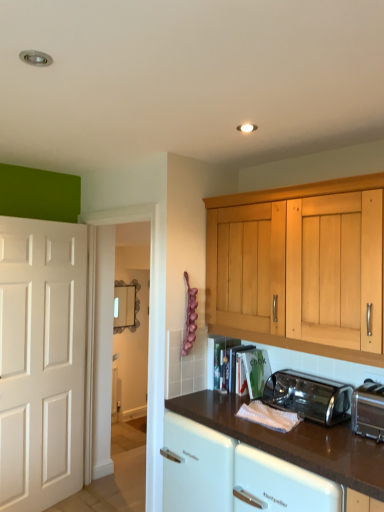
Locate an element on the screen. The image size is (384, 512). blank space above polished stainless steel toaster at lower center, which is the second toaster from front to back (from a real-world perspective) is located at coordinates (322, 374).